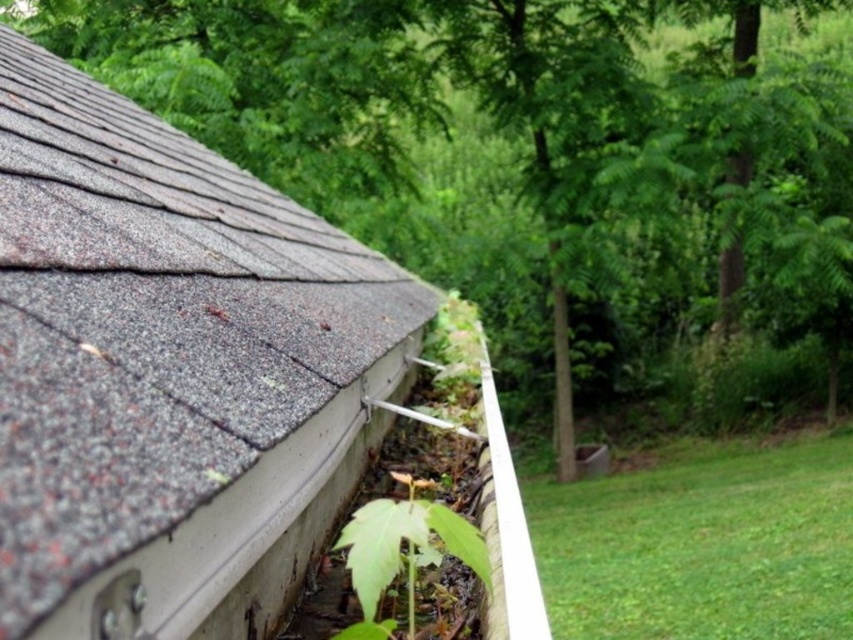
Based on the photo, who is positioned more to the left, gray shingles at upper left or green leafy plant at lower center?

gray shingles at upper left is more to the left.

Between gray shingles at upper left and green leafy plant at lower center, which one has less height?

With less height is green leafy plant at lower center.

Measure the distance between point (256,483) and camera.

Point (256,483) and camera are 3.72 feet apart from each other.

I want to click on gray shingles at upper left, so click(x=170, y=369).